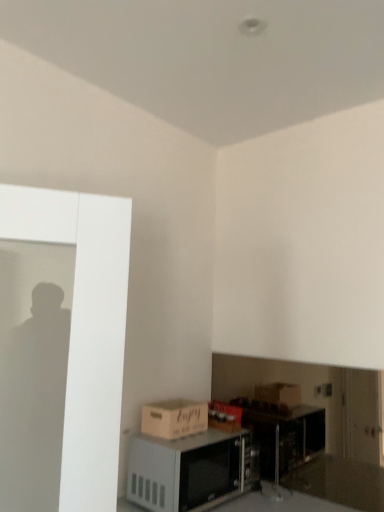
Question: Does white matte microwave at lower center have a smaller size compared to matte brown cardboard box at lower left?

Choices:
 (A) yes
 (B) no

Answer: (B)

Question: Is white matte microwave at lower center far from matte brown cardboard box at lower left?

Choices:
 (A) yes
 (B) no

Answer: (B)

Question: Is white matte microwave at lower center closer to camera compared to matte brown cardboard box at lower left?

Choices:
 (A) no
 (B) yes

Answer: (B)

Question: Is white matte microwave at lower center behind matte brown cardboard box at lower left?

Choices:
 (A) yes
 (B) no

Answer: (B)

Question: Is white matte microwave at lower center at the left side of matte brown cardboard box at lower left?

Choices:
 (A) no
 (B) yes

Answer: (A)

Question: Is matte brown cardboard box at lower left inside white matte microwave at lower center?

Choices:
 (A) no
 (B) yes

Answer: (A)

Question: From a real-world perspective, does matte brown cardboard box at lower left sit lower than white matte microwave at lower center?

Choices:
 (A) yes
 (B) no

Answer: (B)

Question: Is matte brown cardboard box at lower left positioned before white matte microwave at lower center?

Choices:
 (A) yes
 (B) no

Answer: (B)

Question: Could white matte microwave at lower center be considered to be inside matte brown cardboard box at lower left?

Choices:
 (A) yes
 (B) no

Answer: (B)

Question: Considering the relative sizes of matte brown cardboard box at lower left and white matte microwave at lower center in the image provided, is matte brown cardboard box at lower left thinner than white matte microwave at lower center?

Choices:
 (A) no
 (B) yes

Answer: (B)

Question: Is the position of matte brown cardboard box at lower left more distant than that of white matte microwave at lower center?

Choices:
 (A) yes
 (B) no

Answer: (A)

Question: Considering the relative positions of matte brown cardboard box at lower left and white matte microwave at lower center in the image provided, is matte brown cardboard box at lower left to the left of white matte microwave at lower center from the viewer's perspective?

Choices:
 (A) no
 (B) yes

Answer: (B)

Question: From a real-world perspective, is white matte microwave at lower center positioned above or below matte brown cardboard box at lower left?

Choices:
 (A) above
 (B) below

Answer: (B)